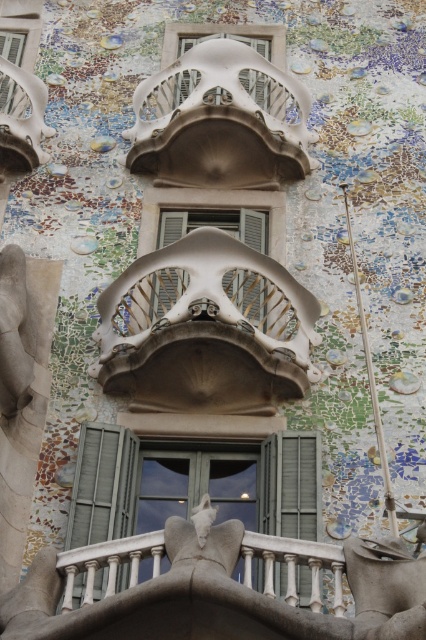
Based on the photo, can you confirm if matte glass window at center is shorter than green matte shutter at right?

Yes.

Is point (236, 513) closer to viewer compared to point (276, 458)?

That is False.

You are a GUI agent. You are given a task and a screenshot of the screen. Output one action in this format:
    pyautogui.click(x=<x>, y=<y>)
    Task: Click on the matte glass window at center
    Image resolution: width=426 pixels, height=640 pixels.
    Given the screenshot: What is the action you would take?
    pyautogui.click(x=195, y=484)

The image size is (426, 640). What do you see at coordinates (192, 484) in the screenshot? I see `green matte window at center` at bounding box center [192, 484].

Is green matte window at center shorter than green matte shutter at right?

No, green matte window at center is not shorter than green matte shutter at right.

Where is `green matte window at center`? green matte window at center is located at coordinates (192, 484).

Does matte white balcony at center appear over green matte shutter at lower left?

Correct, matte white balcony at center is located above green matte shutter at lower left.

Which is more to the left, matte white balcony at center or green matte shutter at lower left?

Answer: From the viewer's perspective, green matte shutter at lower left appears more on the left side.

Based on the photo, who is more forward, (115,364) or (75,529)?

Positioned in front is point (75,529).

You are a GUI agent. You are given a task and a screenshot of the screen. Output one action in this format:
    pyautogui.click(x=<x>, y=<y>)
    Task: Click on the matte white balcony at center
    The image size is (426, 640).
    Given the screenshot: What is the action you would take?
    pyautogui.click(x=206, y=330)